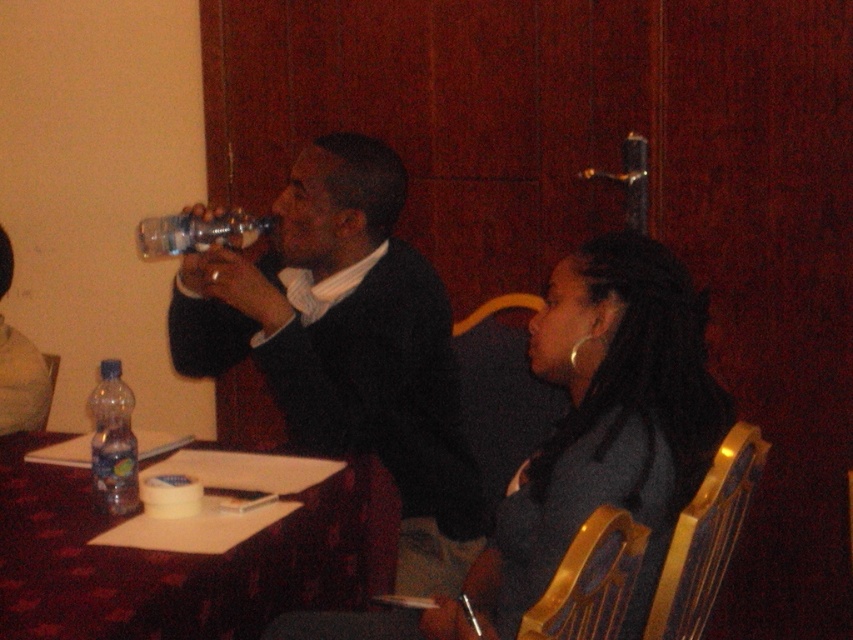
Question: Is gold wood chair at right above clear plastic bottle at upper left?

Choices:
 (A) yes
 (B) no

Answer: (B)

Question: Which of the following is the closest to the observer?

Choices:
 (A) (738, 467)
 (B) (450, 419)

Answer: (A)

Question: Based on their relative distances, which object is farther from the clear plastic bottle at upper left?

Choices:
 (A) gold wood chair at right
 (B) wooden chair at lower right

Answer: (B)

Question: Can you confirm if matte black jacket at center is positioned to the left of gold wood chair at right?

Choices:
 (A) no
 (B) yes

Answer: (B)

Question: Can you confirm if matte black sweater at center is smaller than gold wood chair at right?

Choices:
 (A) no
 (B) yes

Answer: (A)

Question: Estimate the real-world distances between objects in this image. Which object is farther from the matte black jacket at center?

Choices:
 (A) clear plastic bottle at upper left
 (B) matte black sweater at center

Answer: (A)